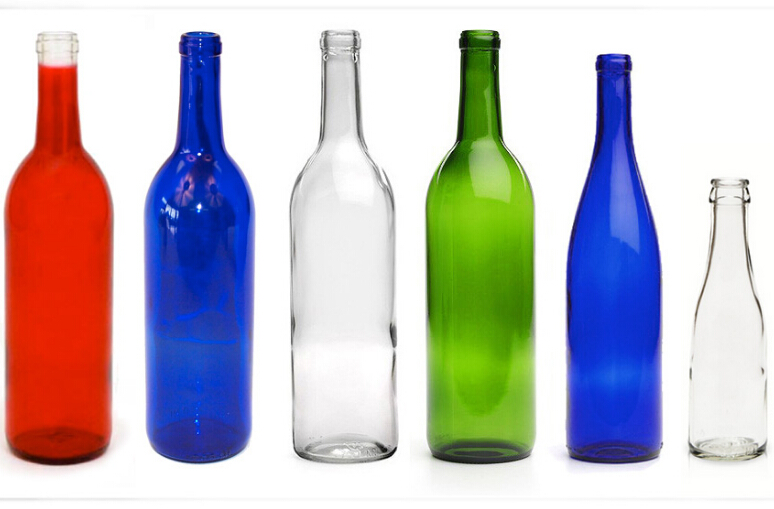
Find the location of a particular element. colored glass is located at coordinates (63, 336), (192, 347), (492, 353), (628, 367).